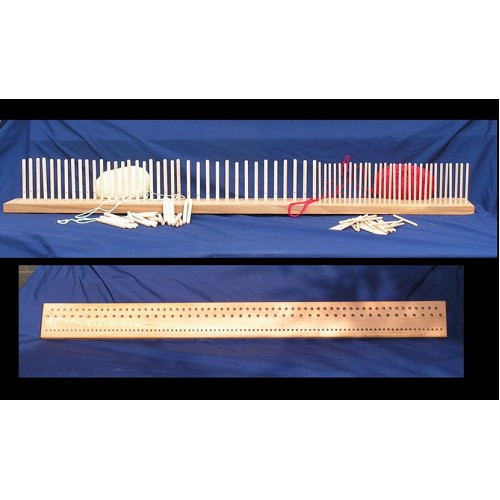
This screenshot has height=500, width=500. I want to click on wood board with holes, so click(243, 320).